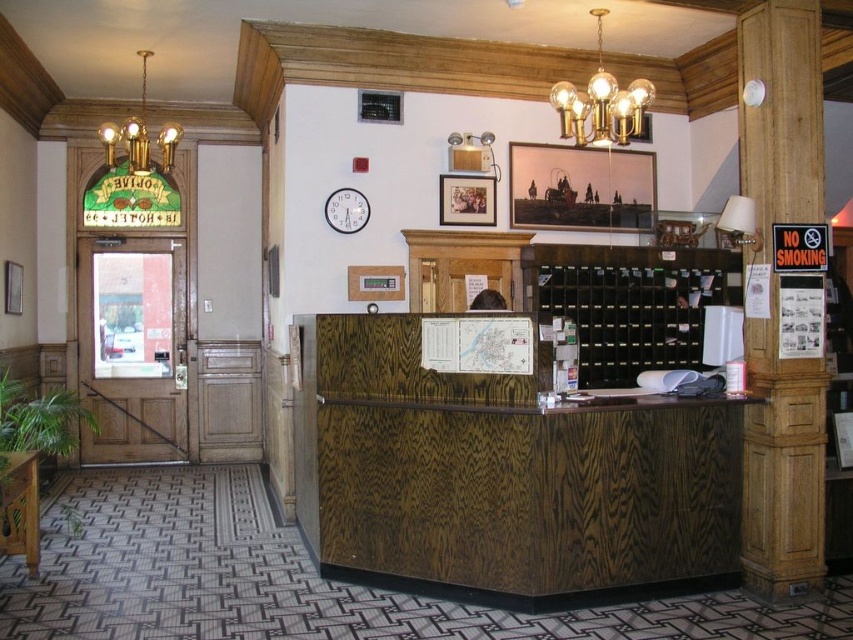
Does gold metallic chandelier at upper center have a lesser height compared to white wooden clock at upper center?

Incorrect, gold metallic chandelier at upper center's height does not fall short of white wooden clock at upper center's.

At what (x,y) coordinates should I click in order to perform the action: click on gold metallic chandelier at upper center. Please return your answer as a coordinate pair (x, y). The width and height of the screenshot is (853, 640). Looking at the image, I should click on coord(601,104).

Identify the location of gold metallic chandelier at upper center. 601,104.

This screenshot has height=640, width=853. I want to click on gold metallic chandelier at upper center, so click(601, 104).

Based on the photo, is gold metallic chandelier at upper center thinner than matte gold lampshade at upper center?

No.

Where is `gold metallic chandelier at upper center`? This screenshot has width=853, height=640. gold metallic chandelier at upper center is located at coordinates (601, 104).

Can you confirm if wooden pillar at right is taller than matte gold lampshade at upper center?

Yes.

Which of these two, wooden pillar at right or matte gold lampshade at upper center, stands shorter?

With less height is matte gold lampshade at upper center.

Which is behind, point (747, 20) or point (453, 148)?

Point (453, 148)

The image size is (853, 640). I want to click on wooden pillar at right, so click(x=782, y=465).